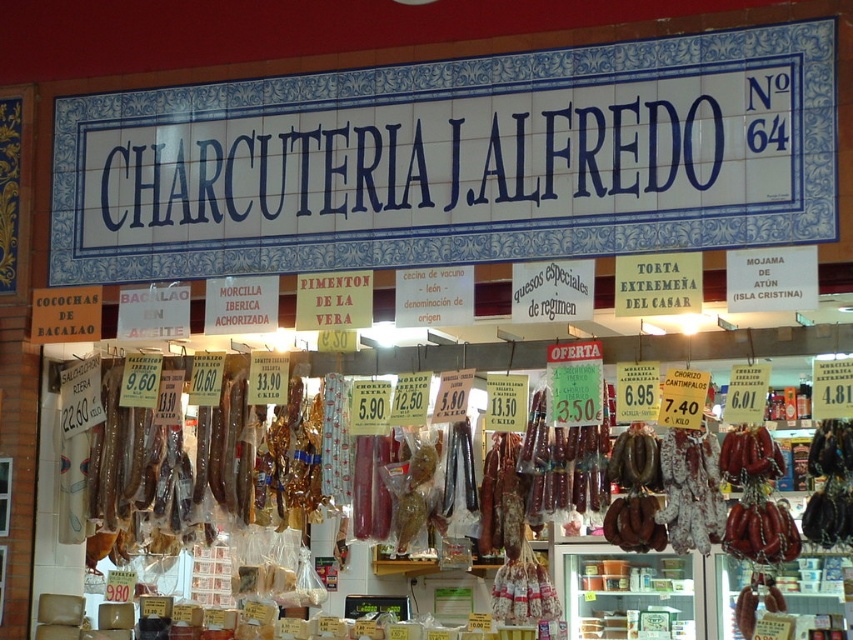
You are a customer in the charcuterie shop and want to buy the shiny brown sausage at center and the brown leather belt at center. The shop has a rule that items wider than 10 cm cannot be placed in the same bag. Can you put both items in the same bag?

The shiny brown sausage at center is wider than the brown leather belt at center. Since the sausage is wider than 10 cm, both items cannot be placed in the same bag according to the shop rule.

You are a customer in the charcuterie shop and want to buy both the brown leather sausages at center and the brown leather belt at center. Which item is located higher on the display?

The brown leather sausages at center are located higher than the brown leather belt at center because the brown leather sausages at center is above brown leather belt at center.